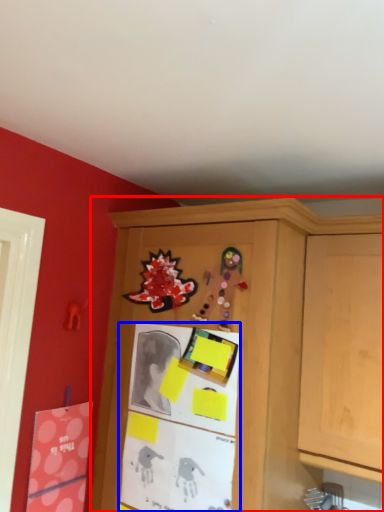
Question: Which point is closer to the camera, cabinetry (highlighted by a red box) or bulletin board (highlighted by a blue box)?

Choices:
 (A) cabinetry
 (B) bulletin board

Answer: (A)